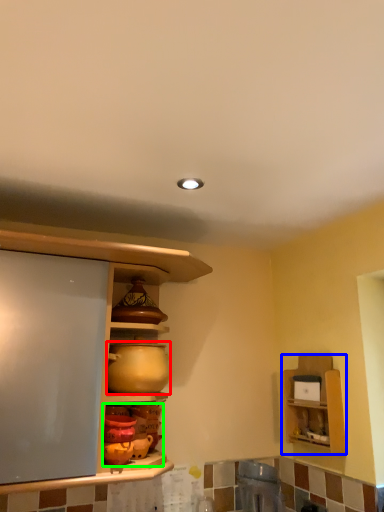
Question: Which object is positioned farthest from appliance (highlighted by a red box)? Select from shelf (highlighted by a blue box) and pottery (highlighted by a green box).

Choices:
 (A) shelf
 (B) pottery

Answer: (A)